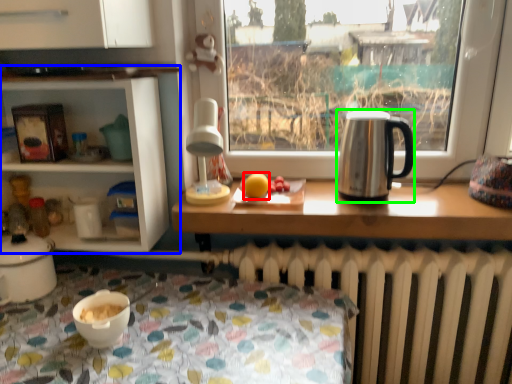
Question: Which object is positioned farthest from orange (highlighted by a red box)? Select from shelf (highlighted by a blue box) and kettle (highlighted by a green box).

Choices:
 (A) shelf
 (B) kettle

Answer: (A)